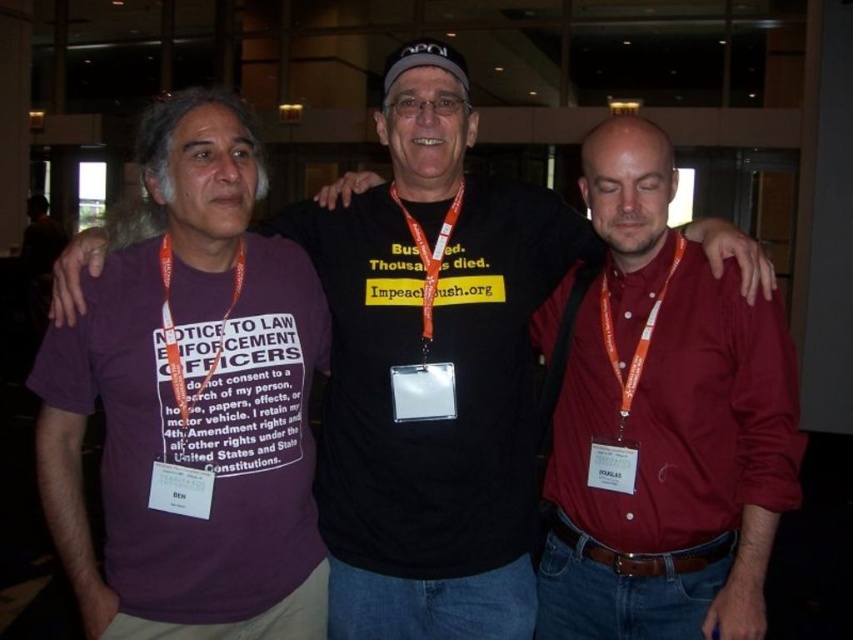
Find the location of a particular element. The height and width of the screenshot is (640, 853). orange lanyard at left is located at coordinates (175, 333).

Is orange lanyard at left below clear plastic badge at center?

Incorrect, orange lanyard at left is not positioned below clear plastic badge at center.

Identify the location of orange lanyard at left. (175, 333).

Is point (792, 493) closer to camera compared to point (393, 410)?

Yes.

Can you confirm if matte red shirt at center is shorter than clear plastic badge at center?

In fact, matte red shirt at center may be taller than clear plastic badge at center.

Does point (764, 404) lie behind point (415, 365)?

No, (764, 404) is closer to viewer.

At what (x,y) coordinates should I click in order to perform the action: click on matte red shirt at center. Please return your answer as a coordinate pair (x, y). This screenshot has height=640, width=853. Looking at the image, I should click on (682, 417).

Does matte red shirt at center appear over orange lanyard at left?

Incorrect, matte red shirt at center is not positioned above orange lanyard at left.

Is point (776, 435) closer to viewer compared to point (175, 346)?

That is False.

Which is in front, point (630, 525) or point (161, 314)?

Point (161, 314) is more forward.

Identify the location of matte red shirt at center. The height and width of the screenshot is (640, 853). (682, 417).